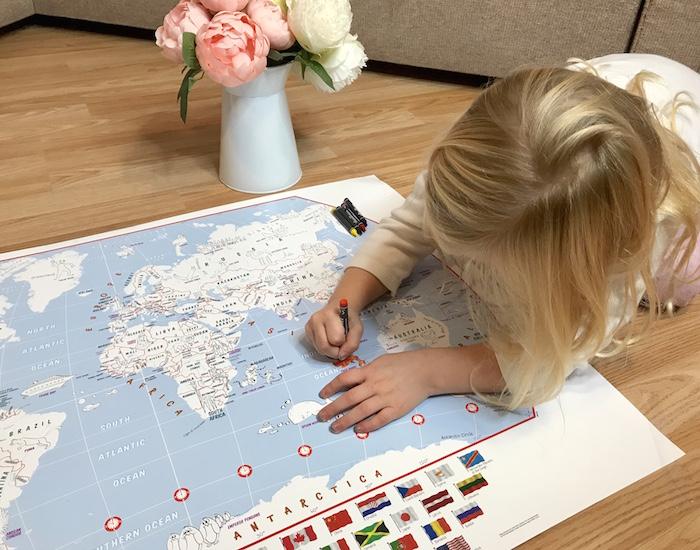
Find the location of a particular element. flooring is located at coordinates (97, 148).